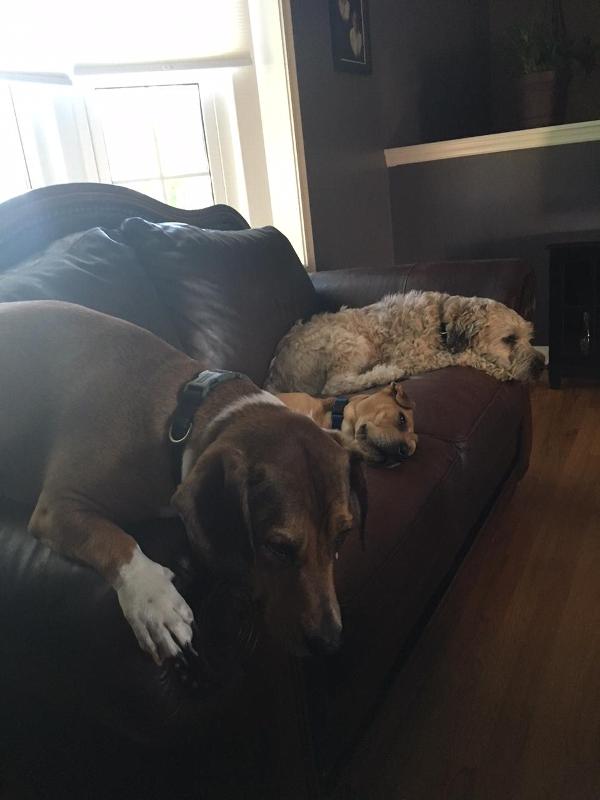
Find the location of a particular element. The image size is (600, 800). couch is located at coordinates (201, 326).